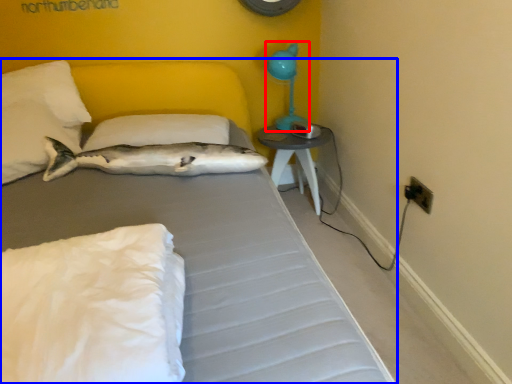
Question: Which of the following is the closest to the observer, table lamp (highlighted by a red box) or bed (highlighted by a blue box)?

Choices:
 (A) table lamp
 (B) bed

Answer: (B)